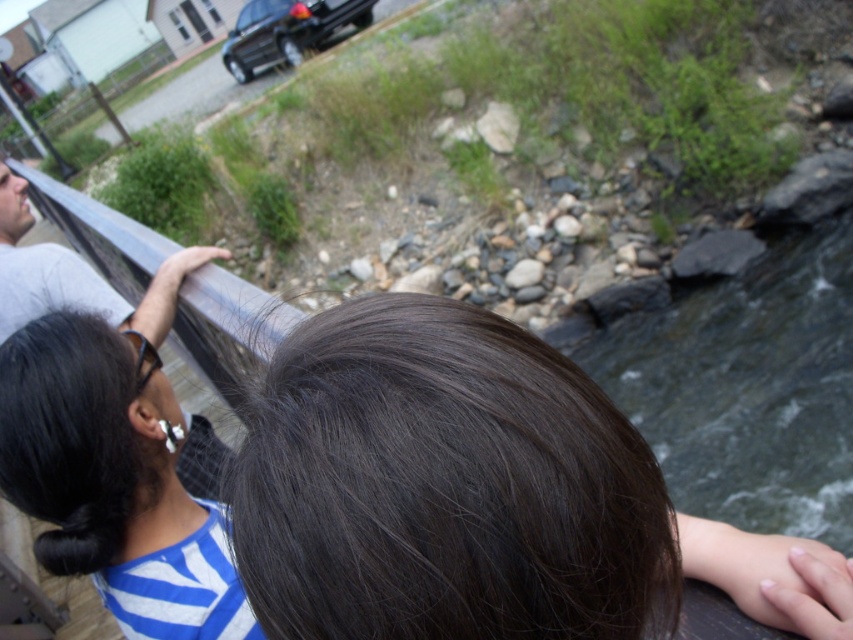
Between black matte hair at upper left and gray fabric shirt at left, which one has less height?

black matte hair at upper left is shorter.

Where is `black matte hair at upper left`? This screenshot has height=640, width=853. black matte hair at upper left is located at coordinates (114, 480).

Consider the image. Is dark brown hair at center wider than gray fabric shirt at left?

Incorrect, dark brown hair at center's width does not surpass gray fabric shirt at left's.

Consider the image. Who is more forward, (425, 300) or (12, 202)?

Positioned in front is point (425, 300).

Is point (544, 512) farther from viewer compared to point (44, 259)?

No, (544, 512) is in front of (44, 259).

At what (x,y) coordinates should I click in order to perform the action: click on dark brown hair at center. Please return your answer as a coordinate pair (x, y). Looking at the image, I should click on (x=479, y=496).

Is dark brown hair at center smaller than black matte hair at upper left?

Correct, dark brown hair at center occupies less space than black matte hair at upper left.

Between point (425, 352) and point (175, 563), which one is positioned behind?

Positioned behind is point (175, 563).

Identify the location of dark brown hair at center. (479, 496).